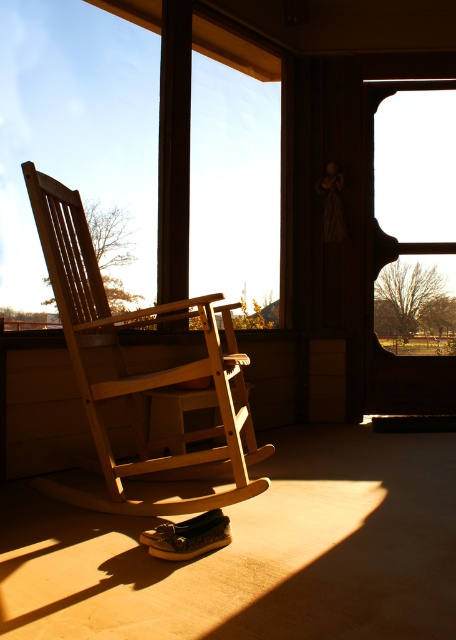
You are standing at the point with coordinates point (135, 374). Based on the scene description, what object are you standing on?

The point (135, 374) corresponds to the light brown wood rocking chair at center, so you are standing on the light brown wood rocking chair at center.

Consider the image. You are standing on the porch and want to move from the light brown wood rocking chair at center to the transparent glass window at center. Which direction should you move to reach it?

You should move to the right to reach the transparent glass window at center from the light brown wood rocking chair at center because the rocking chair is to the left of the window.